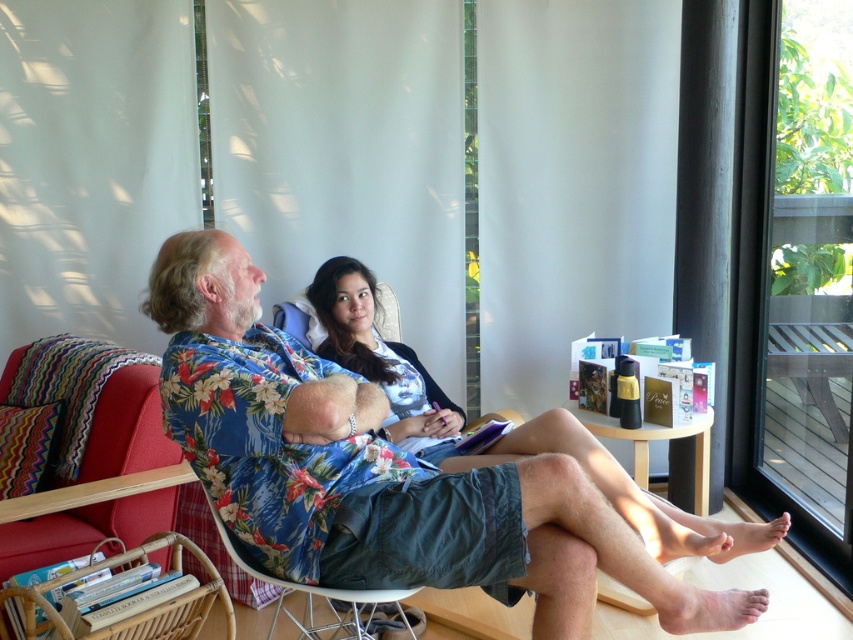
Question: Is transparent glass door at right above matte floral shirt at center?

Choices:
 (A) yes
 (B) no

Answer: (A)

Question: Among these objects, which one is nearest to the camera?

Choices:
 (A) matte floral shirt at center
 (B) transparent glass door at right

Answer: (A)

Question: Does transparent glass door at right appear under matte floral shirt at center?

Choices:
 (A) no
 (B) yes

Answer: (A)

Question: Which point is closer to the camera?

Choices:
 (A) matte floral shirt at center
 (B) transparent glass door at right

Answer: (A)

Question: Does transparent glass door at right come behind matte floral shirt at center?

Choices:
 (A) no
 (B) yes

Answer: (B)